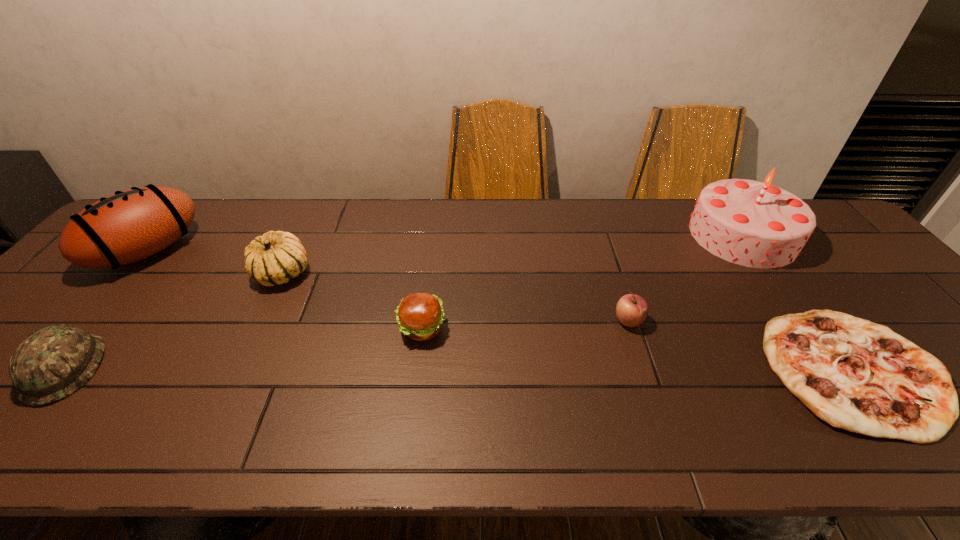
Where is `free space between the birthday cake and the gourd`? The width and height of the screenshot is (960, 540). free space between the birthday cake and the gourd is located at coordinates (513, 254).

Locate an element on the screen. This screenshot has width=960, height=540. free spot between the tallest object and the sixth shortest object is located at coordinates (445, 243).

Locate an element on the screen. free spot between the hamburger and the gourd is located at coordinates (352, 301).

The image size is (960, 540). In order to click on vacant area between the football (American) and the third object from left to right in this screenshot , I will do `click(215, 262)`.

Where is `empty location between the hamburger and the gourd`? The image size is (960, 540). empty location between the hamburger and the gourd is located at coordinates (352, 301).

The image size is (960, 540). Identify the location of object that is the second closest to the headwear. (276, 257).

Find the location of `object that is the closest to the fourth object from right to left`. object that is the closest to the fourth object from right to left is located at coordinates (276, 257).

Find the location of a particular element. vacant point that satisfies the following two spatial constraints: 1. on the front side of the hamburger; 2. on the right side of the gourd is located at coordinates (256, 328).

The width and height of the screenshot is (960, 540). I want to click on blank space that satisfies the following two spatial constraints: 1. on the back side of the apple; 2. on the right side of the hamburger, so click(422, 321).